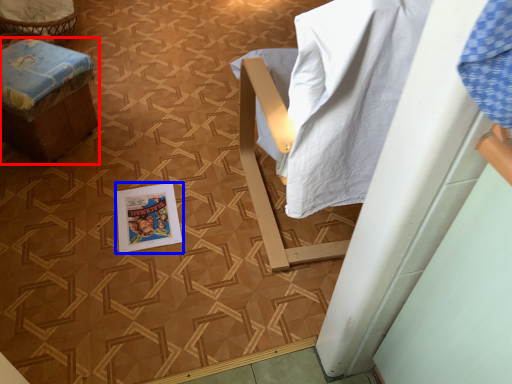
Question: Which of the following is the closest to the observer, furniture (highlighted by a red box) or comic book (highlighted by a blue box)?

Choices:
 (A) furniture
 (B) comic book

Answer: (A)